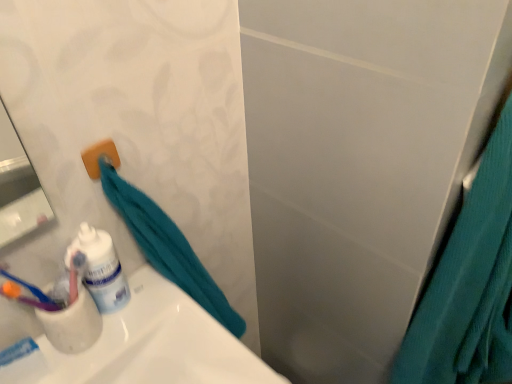
Question: From a real-world perspective, is teal fabric towel at left above or below white matte toothpaste at lower left?

Choices:
 (A) below
 (B) above

Answer: (A)

Question: In the image, is teal fabric towel at left positioned in front of or behind white matte toothpaste at lower left?

Choices:
 (A) behind
 (B) front

Answer: (B)

Question: Considering the real-world distances, which object is closest to the white glossy toothpaste tube at lower left?

Choices:
 (A) white matte toothpaste at lower left
 (B) teal fabric shower curtain at right
 (C) teal fabric towel at left

Answer: (C)

Question: Which is nearer to the teal fabric towel at left?

Choices:
 (A) teal fabric shower curtain at right
 (B) white glossy toothpaste tube at lower left
 (C) white matte toothpaste at lower left

Answer: (B)